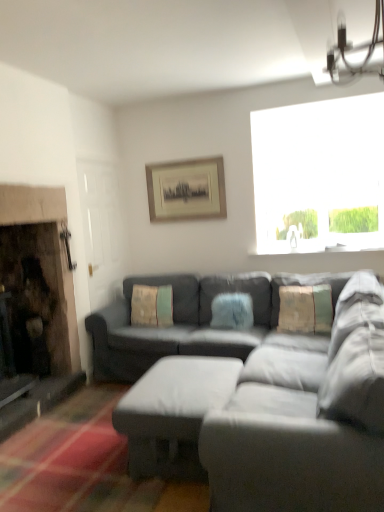
In order to click on matte gray couch at center in this screenshot , I will do `click(235, 401)`.

Where is `white plastic light fixture at upper right`? The height and width of the screenshot is (512, 384). white plastic light fixture at upper right is located at coordinates [x=354, y=51].

Describe the element at coordinates (232, 311) in the screenshot. This screenshot has height=512, width=384. I see `fuzzy blue pillow at center, acting as the second pillow starting from the right` at that location.

You are a GUI agent. You are given a task and a screenshot of the screen. Output one action in this format:
    pyautogui.click(x=<x>, y=<y>)
    Task: Click on the matte black picture frame at upper center
    The height and width of the screenshot is (512, 384).
    Given the screenshot: What is the action you would take?
    pyautogui.click(x=186, y=190)

Find the location of a particular element. This screenshot has height=512, width=384. matte gray couch at center is located at coordinates (235, 401).

Based on the photo, from a real-world perspective, does white plastic light fixture at upper right sit lower than matte gray couch at center?

No, from a real-world perspective, white plastic light fixture at upper right is not under matte gray couch at center.

Would you say white plastic light fixture at upper right is a long distance from matte gray couch at center?

Yes, white plastic light fixture at upper right and matte gray couch at center are located far from each other.

Considering the points (342, 29) and (252, 462), which point is behind, point (342, 29) or point (252, 462)?

The point (342, 29) is farther from the camera.

From the image's perspective, who appears lower, white plastic light fixture at upper right or matte gray couch at center?

matte gray couch at center.

Is fuzzy blue pillow at center, acting as the second pillow starting from the right, next to textured beige pillow at center, placed as the third pillow when sorted from left to right, and touching it?

No, fuzzy blue pillow at center, acting as the second pillow starting from the right, is not with textured beige pillow at center, placed as the third pillow when sorted from left to right.

Is fuzzy blue pillow at center, which is the second pillow in left-to-right order, facing away from textured beige pillow at center, which appears as the 1th pillow when viewed from the right?

No, fuzzy blue pillow at center, which is the second pillow in left-to-right order, is not facing the opposite direction of textured beige pillow at center, which appears as the 1th pillow when viewed from the right.

Between fuzzy blue pillow at center, which is the second pillow in left-to-right order, and textured beige pillow at center, placed as the third pillow when sorted from left to right, which one is positioned in front?

textured beige pillow at center, placed as the third pillow when sorted from left to right.

From a real-world perspective, is fuzzy blue pillow at center, which is the second pillow in left-to-right order, on textured beige pillow at center, which appears as the 1th pillow when viewed from the right?

No, from a real-world perspective, fuzzy blue pillow at center, which is the second pillow in left-to-right order, is not above textured beige pillow at center, which appears as the 1th pillow when viewed from the right.

Could you tell me if transparent glass window at upper right is facing fuzzy blue pillow at center, acting as the second pillow starting from the right?

No, transparent glass window at upper right is not oriented towards fuzzy blue pillow at center, acting as the second pillow starting from the right.

Is transparent glass window at upper right not close to fuzzy blue pillow at center, acting as the second pillow starting from the right?

Yes, transparent glass window at upper right and fuzzy blue pillow at center, acting as the second pillow starting from the right, are quite far apart.

How much distance is there between transparent glass window at upper right and fuzzy blue pillow at center, which is the second pillow in left-to-right order?

The distance of transparent glass window at upper right from fuzzy blue pillow at center, which is the second pillow in left-to-right order, is 1.34 meters.

Find the location of `window that is above the fuzzy blue pillow at center, acting as the second pillow starting from the right (from a real-world perspective)`. window that is above the fuzzy blue pillow at center, acting as the second pillow starting from the right (from a real-world perspective) is located at coordinates (319, 175).

Is matte black picture frame at upper center positioned beyond the bounds of transparent glass window at upper right?

Yes, matte black picture frame at upper center is located beyond the bounds of transparent glass window at upper right.

Which object is thinner, matte black picture frame at upper center or transparent glass window at upper right?

matte black picture frame at upper center.

Is point (184, 164) less distant than point (310, 196)?

That is True.

From a real-world perspective, is fuzzy blue pillow at center, acting as the second pillow starting from the right, on top of transparent glass window at upper right?

Incorrect, from a real-world perspective, fuzzy blue pillow at center, acting as the second pillow starting from the right, is lower than transparent glass window at upper right.

Considering the positions of objects fuzzy blue pillow at center, which is the second pillow in left-to-right order, and transparent glass window at upper right in the image provided, who is in front, fuzzy blue pillow at center, which is the second pillow in left-to-right order, or transparent glass window at upper right?

fuzzy blue pillow at center, which is the second pillow in left-to-right order.

How many degrees apart are the facing directions of fuzzy blue pillow at center, which is the second pillow in left-to-right order, and transparent glass window at upper right?

The angle between the facing direction of fuzzy blue pillow at center, which is the second pillow in left-to-right order, and the facing direction of transparent glass window at upper right is 3.16 degrees.

Would you say fuzzy blue pillow at center, which is the second pillow in left-to-right order, is inside or outside transparent glass window at upper right?

fuzzy blue pillow at center, which is the second pillow in left-to-right order, is located beyond the bounds of transparent glass window at upper right.

Measure the distance between matte gray couch at center and textured beige pillow at center, arranged as the first pillow when viewed from the left.

Answer: matte gray couch at center is 36.09 inches away from textured beige pillow at center, arranged as the first pillow when viewed from the left.

Between matte gray couch at center and textured beige pillow at center, the 3th pillow positioned from the right, which one has larger size?

Bigger between the two is matte gray couch at center.

Is matte gray couch at center aimed at textured beige pillow at center, the 3th pillow positioned from the right?

Yes, matte gray couch at center faces towards textured beige pillow at center, the 3th pillow positioned from the right.

Which of these two, matte gray couch at center or textured beige pillow at center, arranged as the first pillow when viewed from the left, is thinner?

textured beige pillow at center, arranged as the first pillow when viewed from the left, is thinner.

Which of these two, textured beige pillow at center, placed as the third pillow when sorted from left to right, or white plastic light fixture at upper right, stands taller?

white plastic light fixture at upper right is taller.

Where is `the 1st pillow behind the white plastic light fixture at upper right, starting your count from the anchor`? the 1st pillow behind the white plastic light fixture at upper right, starting your count from the anchor is located at coordinates (305, 309).

From the image's perspective, is textured beige pillow at center, which appears as the 1th pillow when viewed from the right, under white plastic light fixture at upper right?

Yes.

Does textured beige pillow at center, which appears as the 1th pillow when viewed from the right, have a larger size compared to white plastic light fixture at upper right?

Actually, textured beige pillow at center, which appears as the 1th pillow when viewed from the right, might be smaller than white plastic light fixture at upper right.

You are a GUI agent. You are given a task and a screenshot of the screen. Output one action in this format:
    pyautogui.click(x=<x>, y=<y>)
    Task: Click on the light fixture on the right of matte gray couch at center
    This screenshot has height=512, width=384.
    Given the screenshot: What is the action you would take?
    pyautogui.click(x=354, y=51)

From the textured beige pillow at center, which appears as the 1th pillow when viewed from the right, count the 1st pillow to the left and point to it. Please provide its 2D coordinates.

[(232, 311)]

When comparing their distances from white plastic light fixture at upper right, does matte gray ottoman at center or matte black picture frame at upper center seem further?

Based on the image, matte black picture frame at upper center appears to be further to white plastic light fixture at upper right.

Based on their spatial positions, is white plastic light fixture at upper right or textured beige pillow at center, arranged as the first pillow when viewed from the left, closer to fuzzy blue pillow at center, which is the second pillow in left-to-right order?

Among the two, textured beige pillow at center, arranged as the first pillow when viewed from the left, is located nearer to fuzzy blue pillow at center, which is the second pillow in left-to-right order.

Considering their positions, is fuzzy blue pillow at center, which is the second pillow in left-to-right order, positioned closer to textured beige pillow at center, placed as the third pillow when sorted from left to right, than matte gray ottoman at center?

Among the two, fuzzy blue pillow at center, which is the second pillow in left-to-right order, is located nearer to textured beige pillow at center, placed as the third pillow when sorted from left to right.

Looking at the image, which one is located further to white plastic light fixture at upper right, textured beige pillow at center, placed as the third pillow when sorted from left to right, or matte black picture frame at upper center?

The object further to white plastic light fixture at upper right is matte black picture frame at upper center.

Considering their positions, is transparent glass window at upper right positioned closer to white plastic light fixture at upper right than matte gray ottoman at center?

Based on the image, transparent glass window at upper right appears to be nearer to white plastic light fixture at upper right.

Looking at the image, which one is located closer to textured beige pillow at center, which appears as the 1th pillow when viewed from the right, matte gray couch at center or matte black picture frame at upper center?

matte gray couch at center is closer to textured beige pillow at center, which appears as the 1th pillow when viewed from the right.

Looking at the image, which one is located further to matte black picture frame at upper center, white plastic light fixture at upper right or fuzzy blue pillow at center, which is the second pillow in left-to-right order?

white plastic light fixture at upper right is further to matte black picture frame at upper center.

Estimate the real-world distances between objects in this image. Which object is further from matte gray couch at center, transparent glass window at upper right or textured beige pillow at center, which appears as the 1th pillow when viewed from the right?

transparent glass window at upper right is positioned further to the anchor matte gray couch at center.

The height and width of the screenshot is (512, 384). In order to click on table positioned between white plastic light fixture at upper right and matte black picture frame at upper center from near to far in this screenshot , I will do `click(172, 413)`.

I want to click on window located between matte gray couch at center and matte black picture frame at upper center in the depth direction, so click(x=319, y=175).

Locate an element on the screen. The image size is (384, 512). table located between matte gray couch at center and transparent glass window at upper right in the depth direction is located at coordinates [172, 413].

Find the location of a particular element. window positioned between matte gray ottoman at center and matte black picture frame at upper center from near to far is located at coordinates (319, 175).